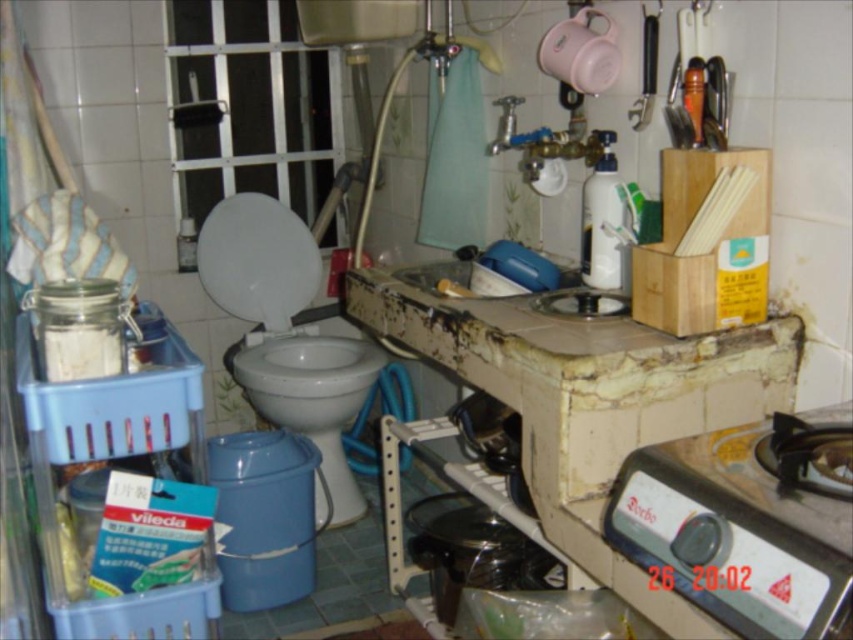
You are a plumber inspecting the bathroom. You need to determine which fixture is taller between the white glossy toilet bowl at center and the blue plastic sink at center. Based on the scene, which one is taller?

The white glossy toilet bowl at center is taller than the blue plastic sink at center according to the description.

You are organizing the bathroom and need to place a new roll of toilet paper. The roll is 15 cm in diameter. The rusty concrete countertop at center and the blue plastic sink at center are both potential locations. Which surface can accommodate the roll without it overhanging the edge, considering their widths?

The blue plastic sink at center can accommodate the 15 cm diameter toilet paper roll without overhanging because the rusty concrete countertop at center is narrower than the sink.

You are trying to place a new rectangular trash can that is 1 meter wide between the rusty concrete countertop at center and the white glossy toilet bowl at center. Based on the scene description, can you fit the trash can between them?

The rusty concrete countertop at center might be wider than the white glossy toilet bowl at center, so the space between them may not be sufficient to fit a 1 meter wide trash can. You should measure the actual distance before deciding.